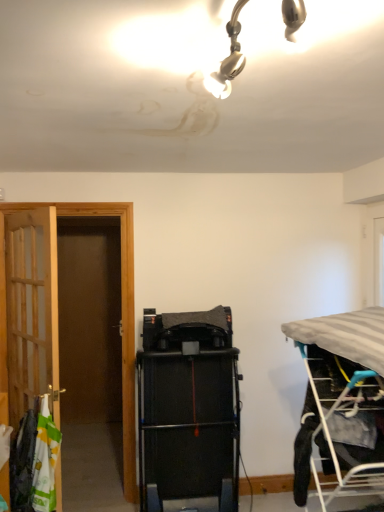
Question: Is wooden door at left outside gray fabric bed at right?

Choices:
 (A) no
 (B) yes

Answer: (B)

Question: From a real-world perspective, is wooden door at left physically below gray fabric bed at right?

Choices:
 (A) no
 (B) yes

Answer: (A)

Question: Can you confirm if wooden door at left is wider than gray fabric bed at right?

Choices:
 (A) yes
 (B) no

Answer: (B)

Question: Considering the relative sizes of wooden door at left and gray fabric bed at right in the image provided, is wooden door at left smaller than gray fabric bed at right?

Choices:
 (A) no
 (B) yes

Answer: (B)

Question: Is wooden door at left shorter than gray fabric bed at right?

Choices:
 (A) no
 (B) yes

Answer: (A)

Question: From a real-world perspective, is wooden door at left physically above gray fabric bed at right?

Choices:
 (A) yes
 (B) no

Answer: (A)

Question: From the image's perspective, does white fabric laundry at left appear higher than wooden door at left?

Choices:
 (A) no
 (B) yes

Answer: (A)

Question: Is the surface of white fabric laundry at left in direct contact with wooden door at left?

Choices:
 (A) yes
 (B) no

Answer: (B)

Question: Could you tell me if white fabric laundry at left is facing wooden door at left?

Choices:
 (A) no
 (B) yes

Answer: (B)

Question: Is white fabric laundry at left further to camera compared to wooden door at left?

Choices:
 (A) yes
 (B) no

Answer: (B)

Question: From the image's perspective, does white fabric laundry at left appear lower than wooden door at left?

Choices:
 (A) no
 (B) yes

Answer: (B)

Question: Considering the relative sizes of white fabric laundry at left and wooden door at left in the image provided, is white fabric laundry at left wider than wooden door at left?

Choices:
 (A) no
 (B) yes

Answer: (B)

Question: Considering the relative sizes of black rubber treadmill at center and wooden door at left in the image provided, is black rubber treadmill at center shorter than wooden door at left?

Choices:
 (A) yes
 (B) no

Answer: (A)